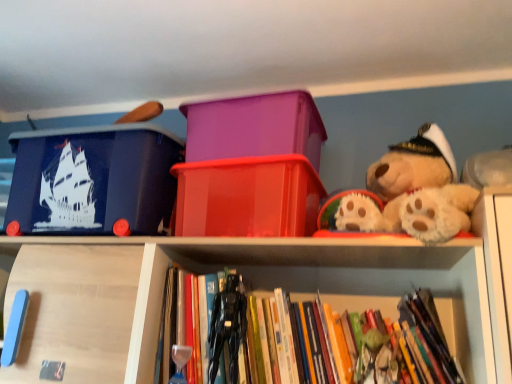
Question: Is translucent red plastic container at center, the second storage box viewed from the left, further to the viewer compared to black plastic action figure at center?

Choices:
 (A) yes
 (B) no

Answer: (A)

Question: Can we say translucent red plastic container at center, acting as the second storage box starting from the right, lies outside black plastic action figure at center?

Choices:
 (A) yes
 (B) no

Answer: (A)

Question: From a real-world perspective, is translucent red plastic container at center, acting as the second storage box starting from the right, beneath black plastic action figure at center?

Choices:
 (A) yes
 (B) no

Answer: (B)

Question: From a real-world perspective, does translucent red plastic container at center, the second storage box viewed from the left, stand above black plastic action figure at center?

Choices:
 (A) yes
 (B) no

Answer: (A)

Question: Considering the relative sizes of translucent red plastic container at center, acting as the second storage box starting from the right, and black plastic action figure at center in the image provided, is translucent red plastic container at center, acting as the second storage box starting from the right, shorter than black plastic action figure at center?

Choices:
 (A) no
 (B) yes

Answer: (B)

Question: Would you say black plastic action figure at center is inside or outside hardcover books at center?

Choices:
 (A) outside
 (B) inside

Answer: (A)

Question: Relative to hardcover books at center, is black plastic action figure at center in front or behind?

Choices:
 (A) front
 (B) behind

Answer: (B)

Question: From a real-world perspective, is black plastic action figure at center positioned above or below hardcover books at center?

Choices:
 (A) below
 (B) above

Answer: (A)

Question: In terms of width, does black plastic action figure at center look wider or thinner when compared to hardcover books at center?

Choices:
 (A) wide
 (B) thin

Answer: (B)

Question: From the image's perspective, is translucent red plastic container at center, the second storage box viewed from the left, above or below purple plastic storage box at center, marked as the first storage box in a right-to-left arrangement?

Choices:
 (A) below
 (B) above

Answer: (A)

Question: Based on their sizes in the image, would you say translucent red plastic container at center, the second storage box viewed from the left, is bigger or smaller than purple plastic storage box at center, marked as the first storage box in a right-to-left arrangement?

Choices:
 (A) big
 (B) small

Answer: (A)

Question: Considering the relative positions of translucent red plastic container at center, acting as the second storage box starting from the right, and purple plastic storage box at center, marked as the first storage box in a right-to-left arrangement, in the image provided, is translucent red plastic container at center, acting as the second storage box starting from the right, to the left or to the right of purple plastic storage box at center, marked as the first storage box in a right-to-left arrangement,?

Choices:
 (A) right
 (B) left

Answer: (B)

Question: Is point (233, 163) positioned closer to the camera than point (266, 147)?

Choices:
 (A) farther
 (B) closer

Answer: (B)

Question: From the image's perspective, is matte blue plastic storage box at upper left, the 1th storage box from the left, located above or below translucent red plastic container at center, the second storage box viewed from the left?

Choices:
 (A) below
 (B) above

Answer: (B)

Question: Is matte blue plastic storage box at upper left, the 1th storage box from the left, in front of or behind translucent red plastic container at center, acting as the second storage box starting from the right, in the image?

Choices:
 (A) front
 (B) behind

Answer: (B)